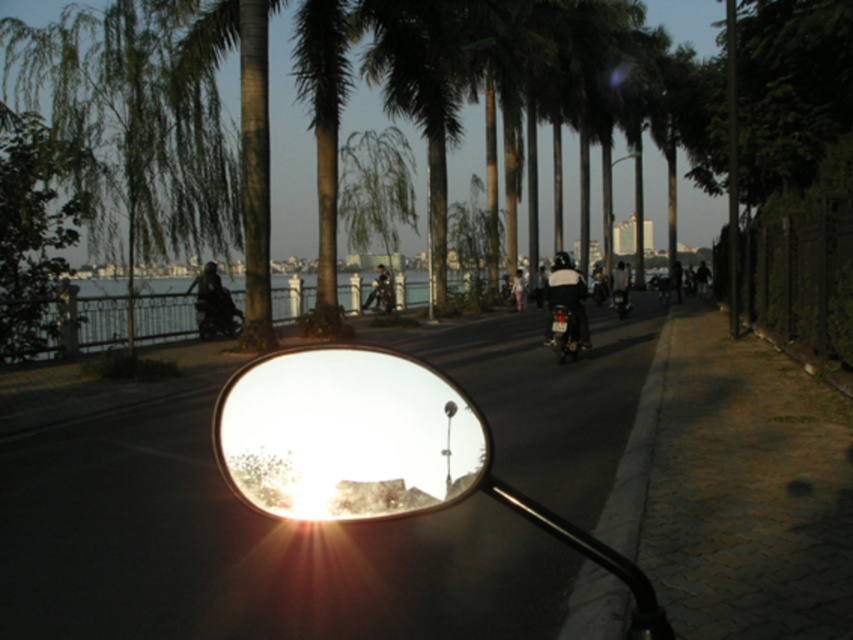
Does metallic reflective mirror at center have a lesser width compared to green textured palm tree at upper left?

Yes.

Is metallic reflective mirror at center shorter than green textured palm tree at upper left?

Yes.

Is point (247, 381) more distant than point (247, 289)?

That is False.

Locate an element on the screen. This screenshot has height=640, width=853. metallic reflective mirror at center is located at coordinates (376, 451).

Between metallic reflective mirror at center and green leafy palm tree at center, which one has less height?

metallic reflective mirror at center is shorter.

Does metallic reflective mirror at center appear on the right side of green leafy palm tree at center?

Correct, you'll find metallic reflective mirror at center to the right of green leafy palm tree at center.

Where is `metallic reflective mirror at center`? metallic reflective mirror at center is located at coordinates (376, 451).

At what (x,y) coordinates should I click in order to perform the action: click on metallic reflective mirror at center. Please return your answer as a coordinate pair (x, y). Looking at the image, I should click on (376, 451).

Is point (245, 140) positioned before point (621, 288)?

Yes, it is.

Locate an element on the screen. The height and width of the screenshot is (640, 853). green textured palm tree at upper left is located at coordinates (241, 136).